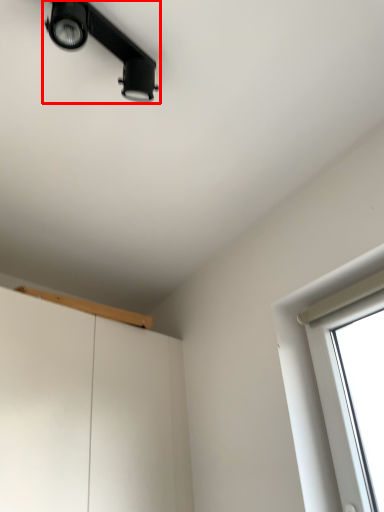
Question: From the image, what is the correct spatial relationship of lamp (annotated by the red box) in relation to window sill?

Choices:
 (A) left
 (B) right

Answer: (B)